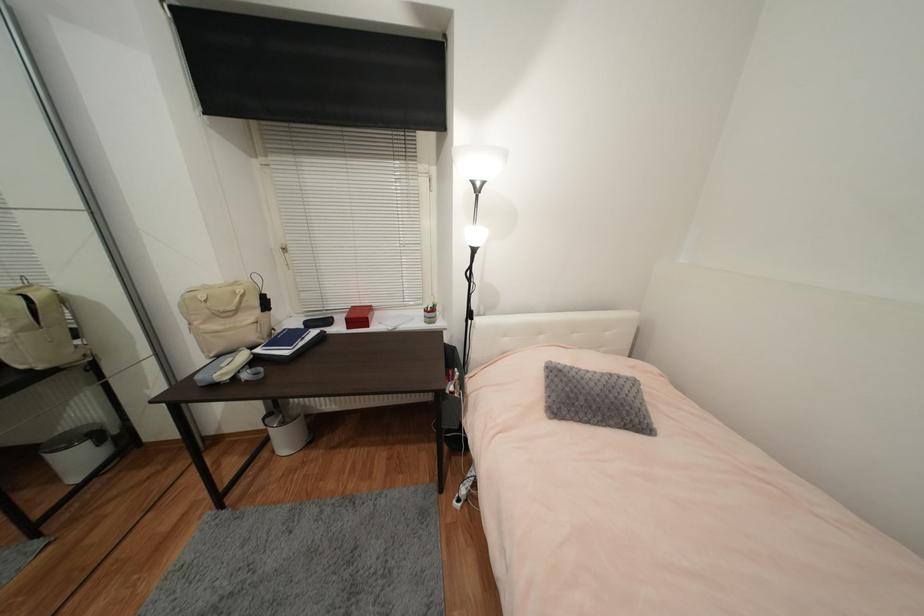
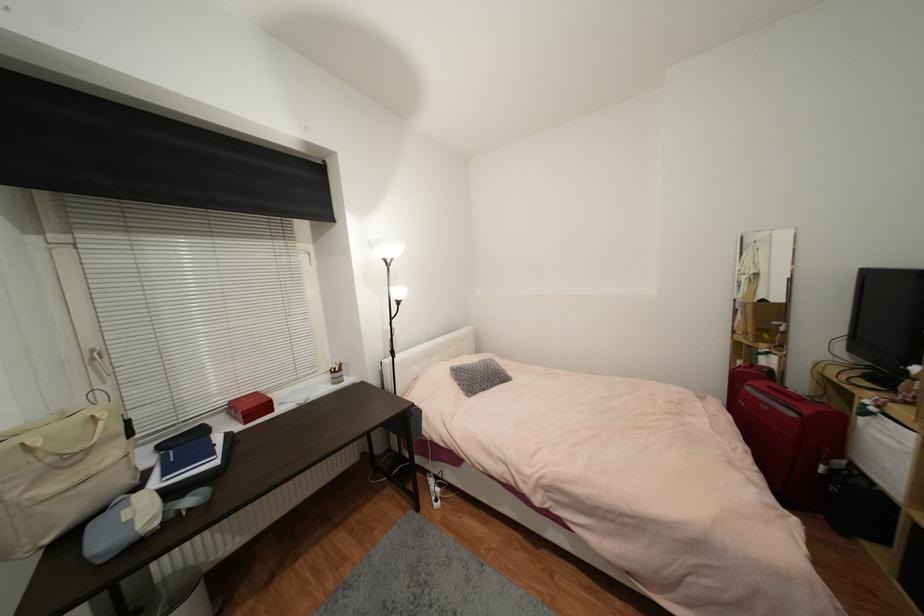
The point at [477,320] is marked in the first image. Where is the corresponding point in the second image?

(398, 358)